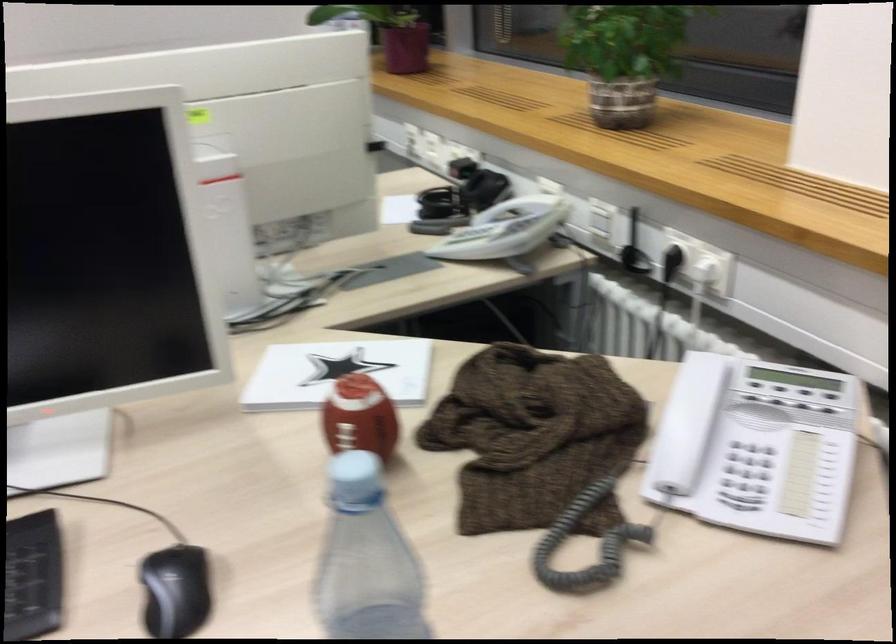
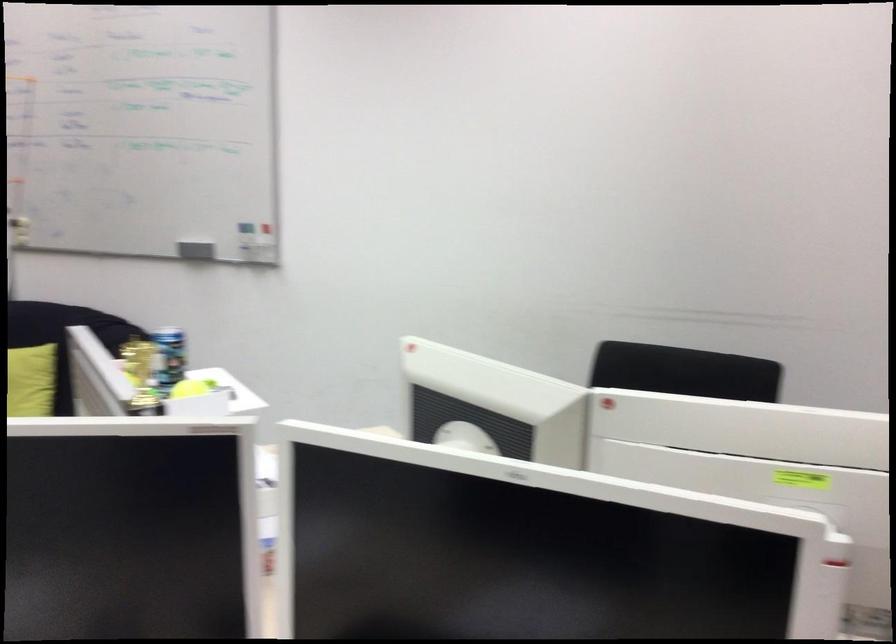
Question: How did the camera likely rotate?

Choices:
 (A) Left
 (B) Right
 (C) Up
 (D) Down

Answer: (A)